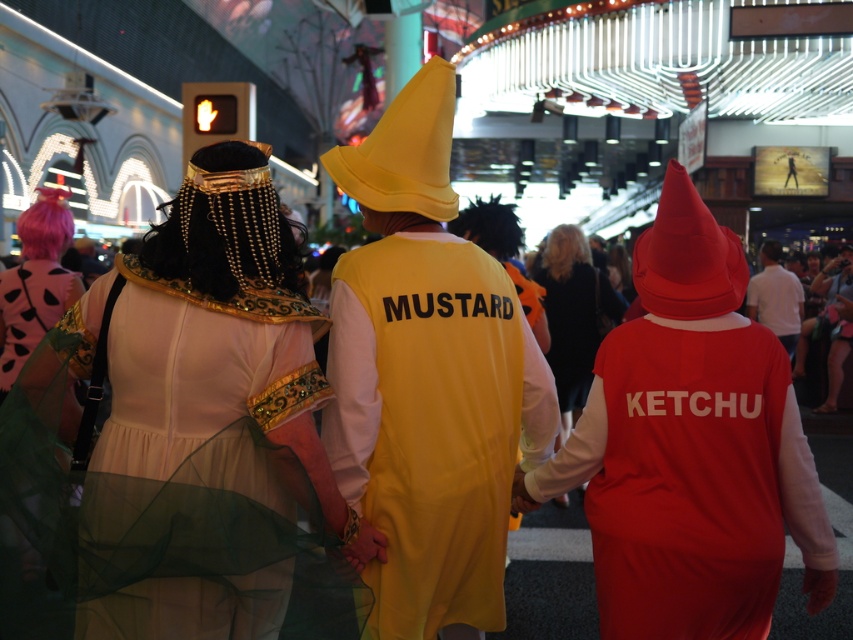
Question: Among these objects, which one is farthest from the camera?

Choices:
 (A) matte red costume at right
 (B) matte gold dress at center
 (C) white cotton shirt at upper right

Answer: (C)

Question: Can you confirm if yellow matte dress at center is positioned to the left of matte gold dress at center?

Choices:
 (A) yes
 (B) no

Answer: (B)

Question: Which point is closer to the camera?

Choices:
 (A) yellow matte dress at center
 (B) matte red costume at right
 (C) matte gold dress at center

Answer: (C)

Question: Based on their relative distances, which object is farther from the matte red costume at right?

Choices:
 (A) matte gold dress at center
 (B) yellow matte dress at center

Answer: (A)

Question: Is yellow matte dress at center positioned at the back of white cotton shirt at upper right?

Choices:
 (A) no
 (B) yes

Answer: (A)

Question: Can you confirm if yellow matte dress at center is positioned below matte red costume at right?

Choices:
 (A) no
 (B) yes

Answer: (A)